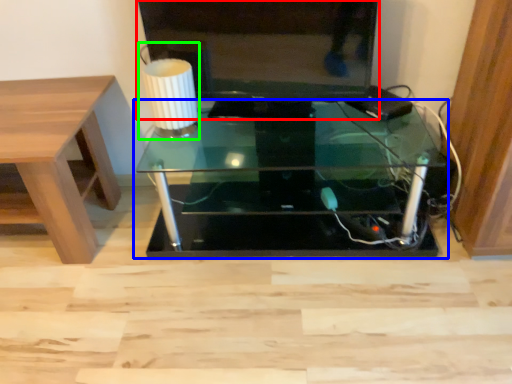
Question: Estimate the real-world distances between objects in this image. Which object is closer to television (highlighted by a red box), table (highlighted by a blue box) or table lamp (highlighted by a green box)?

Choices:
 (A) table
 (B) table lamp

Answer: (B)